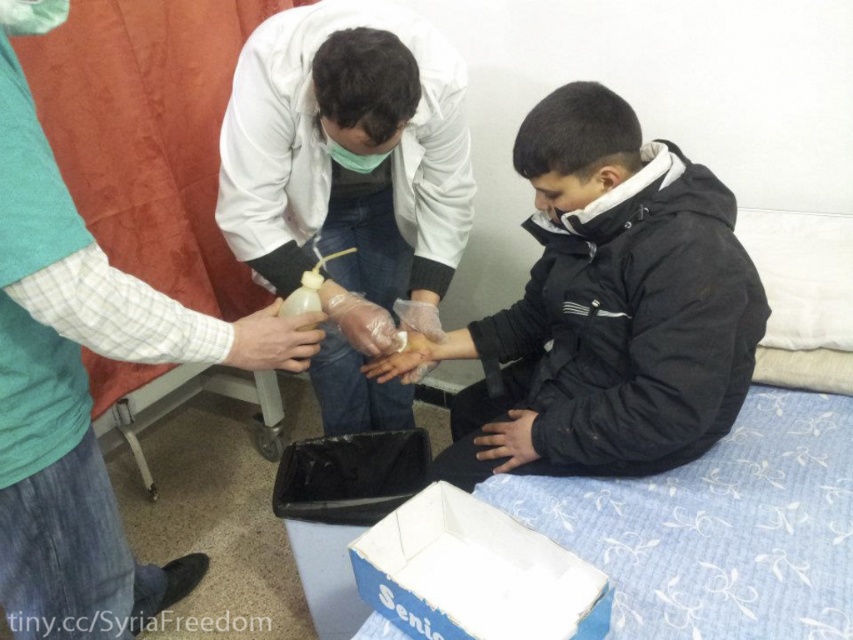
Question: Which point is farther to the camera?

Choices:
 (A) (256, 310)
 (B) (45, 285)

Answer: (A)

Question: Can you confirm if white matte coat at upper left is smaller than blue cardboard box at lower center?

Choices:
 (A) no
 (B) yes

Answer: (A)

Question: Is white matte coat at upper left thinner than blue cardboard box at lower center?

Choices:
 (A) no
 (B) yes

Answer: (A)

Question: Which point is farther from the camera taking this photo?

Choices:
 (A) (38, 195)
 (B) (709, 323)

Answer: (B)

Question: Is white matte coat at upper left to the left of blue cardboard box at lower center from the viewer's perspective?

Choices:
 (A) no
 (B) yes

Answer: (B)

Question: Which object is closer to the camera taking this photo?

Choices:
 (A) black matte jacket at center
 (B) translucent plastic bottle at center
 (C) blue cardboard box at lower center

Answer: (C)